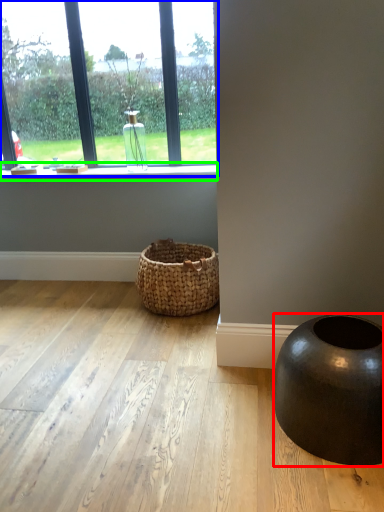
Question: Which object is the farthest from oval (highlighted by a red box)? Choose among these: window (highlighted by a blue box) or window sill (highlighted by a green box).

Choices:
 (A) window
 (B) window sill

Answer: (A)